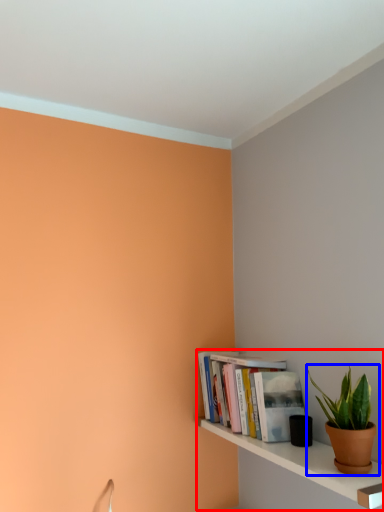
Question: Which object is further to the camera taking this photo, shelf (highlighted by a red box) or houseplant (highlighted by a blue box)?

Choices:
 (A) shelf
 (B) houseplant

Answer: (B)